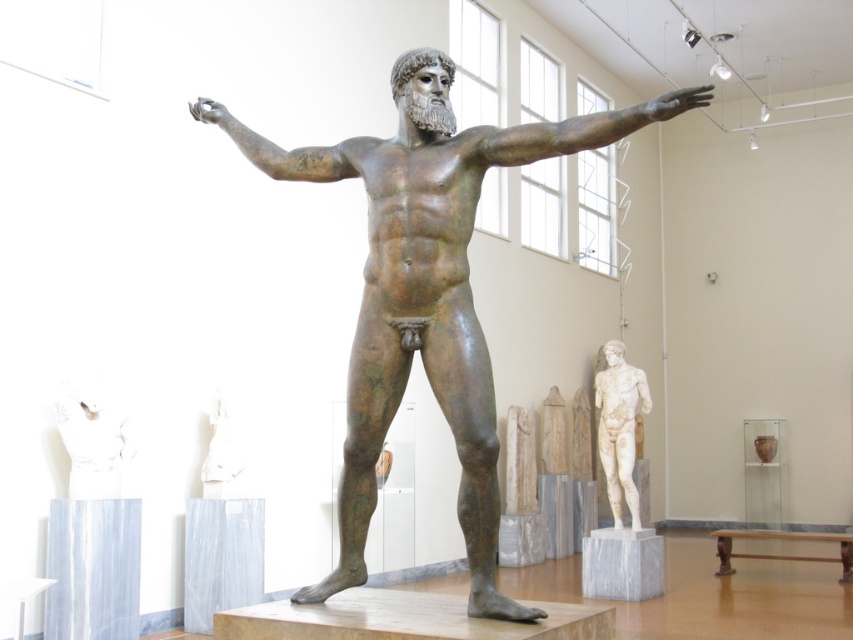
Which of these two, bronze muscular arm at center or bronze/textured arm at center, stands taller?

With more height is bronze muscular arm at center.

What do you see at coordinates (582, 129) in the screenshot? This screenshot has height=640, width=853. I see `bronze muscular arm at center` at bounding box center [582, 129].

The width and height of the screenshot is (853, 640). Find the location of `bronze muscular arm at center`. bronze muscular arm at center is located at coordinates (582, 129).

From the picture: Is bronze statue at center to the right of bronze/textured arm at center from the viewer's perspective?

Indeed, bronze statue at center is positioned on the right side of bronze/textured arm at center.

Is bronze statue at center bigger than bronze/textured arm at center?

Correct, bronze statue at center is larger in size than bronze/textured arm at center.

Is point (380, 205) positioned after point (347, 168)?

No, (380, 205) is closer to viewer.

This screenshot has width=853, height=640. In order to click on bronze statue at center in this screenshot , I will do `click(427, 289)`.

Is bronze statue at center positioned in front of white marble torso at center?

Yes, bronze statue at center is in front of white marble torso at center.

In the scene shown: Between bronze statue at center and white marble torso at center, which one appears on the left side from the viewer's perspective?

Positioned to the left is white marble torso at center.

Identify the location of bronze statue at center. (427, 289).

Identify the location of bronze statue at center. Image resolution: width=853 pixels, height=640 pixels. (427, 289).